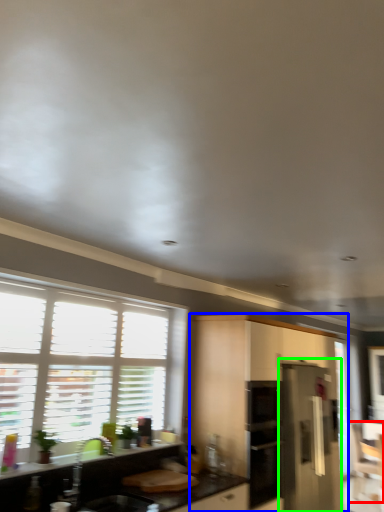
Question: Which object is the closest to the armchair (highlighted by a red box)? Choose among these: cabinetry (highlighted by a blue box) or appliance (highlighted by a green box).

Choices:
 (A) cabinetry
 (B) appliance

Answer: (B)